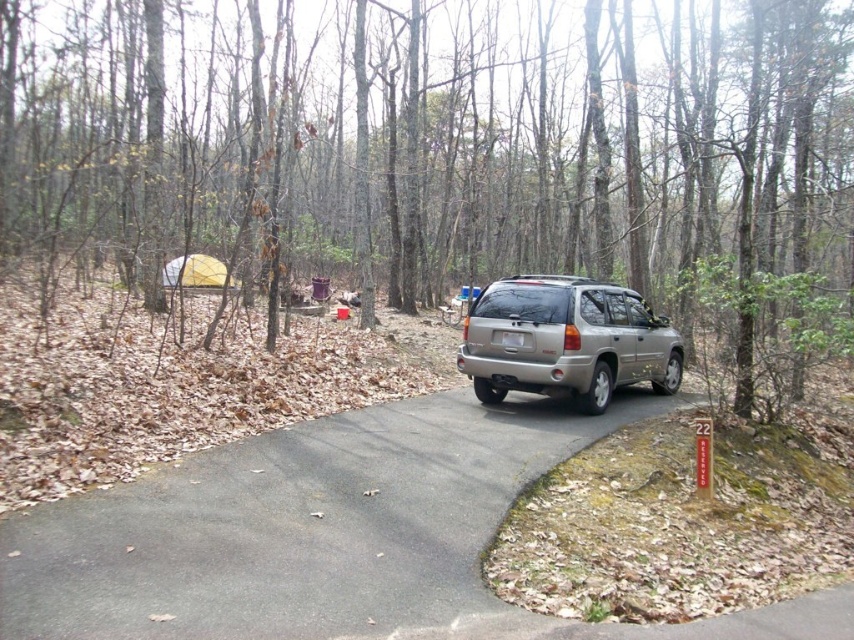
Does gray asphalt road at center appear under silver metallic suv at center?

Correct, gray asphalt road at center is located below silver metallic suv at center.

Which is behind, point (395, 608) or point (478, 388)?

The point (478, 388) is behind.

At what (x,y) coordinates should I click in order to perform the action: click on gray asphalt road at center. Please return your answer as a coordinate pair (x, y). The height and width of the screenshot is (640, 854). Looking at the image, I should click on (303, 529).

Is brown bark tree at center positioned at the back of silver metallic suv at center?

No.

Is point (401, 307) positioned after point (607, 339)?

Yes, it is behind point (607, 339).

Which is in front, point (597, 118) or point (477, 356)?

Positioned in front is point (477, 356).

Locate an element on the screen. The image size is (854, 640). brown bark tree at center is located at coordinates (449, 157).

Does point (296, 154) come behind point (600, 426)?

That is True.

Is point (418, 262) closer to viewer compared to point (509, 396)?

That is False.

What do you see at coordinates (449, 157) in the screenshot?
I see `brown bark tree at center` at bounding box center [449, 157].

The width and height of the screenshot is (854, 640). In order to click on brown bark tree at center in this screenshot , I will do `click(449, 157)`.